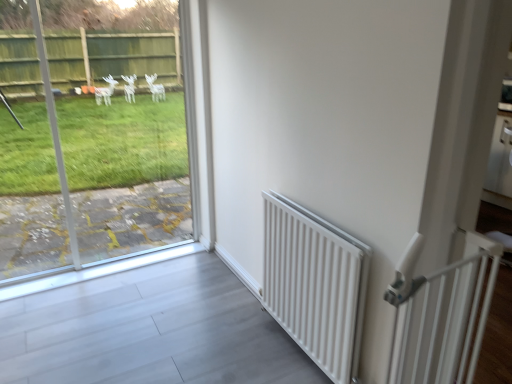
In order to click on vacant space situated on the left part of white matte radiator at right in this screenshot , I will do `click(225, 345)`.